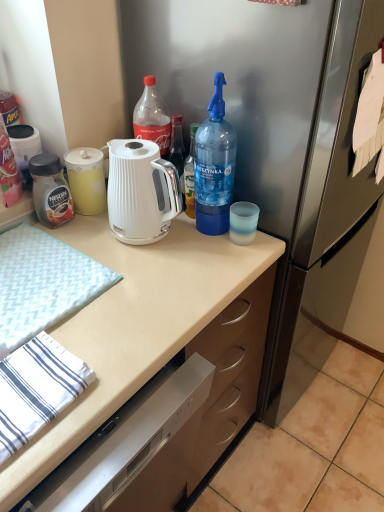
Question: Considering the relative positions of matte black jar at left, the 2th bottle from the right, and white matte countertop at center in the image provided, is matte black jar at left, the 2th bottle from the right, to the right of white matte countertop at center from the viewer's perspective?

Choices:
 (A) no
 (B) yes

Answer: (A)

Question: Is matte black jar at left, the 2th bottle from the right, in front of white matte countertop at center?

Choices:
 (A) no
 (B) yes

Answer: (A)

Question: Is matte black jar at left, the 2th bottle from the right, next to white matte countertop at center and touching it?

Choices:
 (A) no
 (B) yes

Answer: (A)

Question: Considering the relative sizes of matte black jar at left, the 2th bottle from the right, and white matte countertop at center in the image provided, is matte black jar at left, the 2th bottle from the right, shorter than white matte countertop at center?

Choices:
 (A) yes
 (B) no

Answer: (A)

Question: Is matte black jar at left, which is the 2th bottle in left-to-right order, facing away from white matte countertop at center?

Choices:
 (A) no
 (B) yes

Answer: (A)

Question: Does matte black jar at left, which is the 2th bottle in left-to-right order, appear on the left side of white matte countertop at center?

Choices:
 (A) no
 (B) yes

Answer: (B)

Question: Is white textured hand towel at left surrounding matte black jar at left, the 2th bottle from the right?

Choices:
 (A) no
 (B) yes

Answer: (A)

Question: Is white textured hand towel at left placed right next to matte black jar at left, the 2th bottle from the right?

Choices:
 (A) yes
 (B) no

Answer: (B)

Question: Is white textured hand towel at left bigger than matte black jar at left, which is the 2th bottle in left-to-right order?

Choices:
 (A) yes
 (B) no

Answer: (A)

Question: Does white textured hand towel at left have a smaller size compared to matte black jar at left, the 2th bottle from the right?

Choices:
 (A) yes
 (B) no

Answer: (B)

Question: Is white textured hand towel at left thinner than matte black jar at left, which is the 2th bottle in left-to-right order?

Choices:
 (A) no
 (B) yes

Answer: (A)

Question: Is white textured hand towel at left at the right side of matte black jar at left, which is the 2th bottle in left-to-right order?

Choices:
 (A) no
 (B) yes

Answer: (A)

Question: Is matte black jar at left, which is the 1th bottle from left to right, facing towards white textured hand towel at left?

Choices:
 (A) no
 (B) yes

Answer: (A)